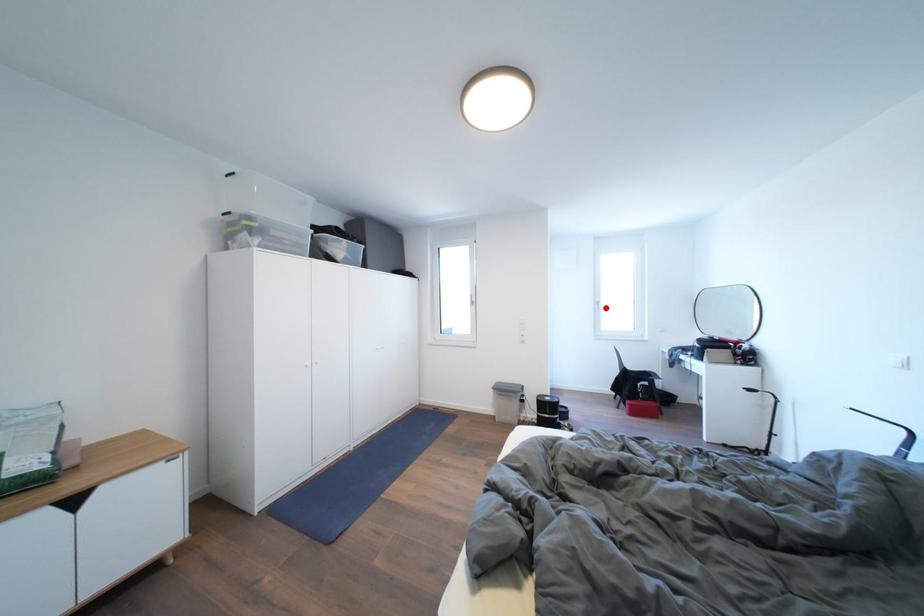
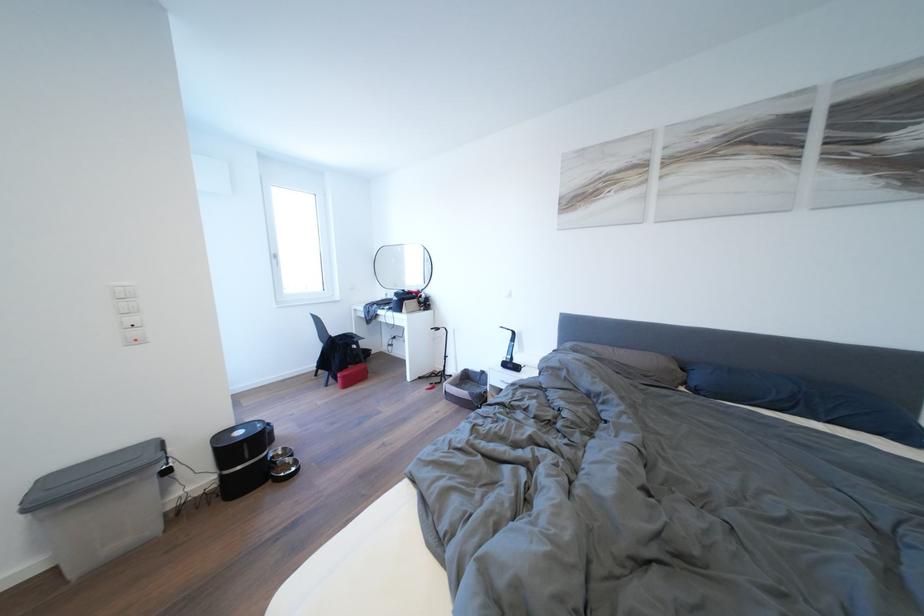
Question: A red point is marked in image1. In image2, is the corresponding 3D point closer to the camera or farther? Reply with the corresponding letter.

Choices:
 (A) The corresponding 3D point is closer.
 (B) The corresponding 3D point is farther.

Answer: (A)